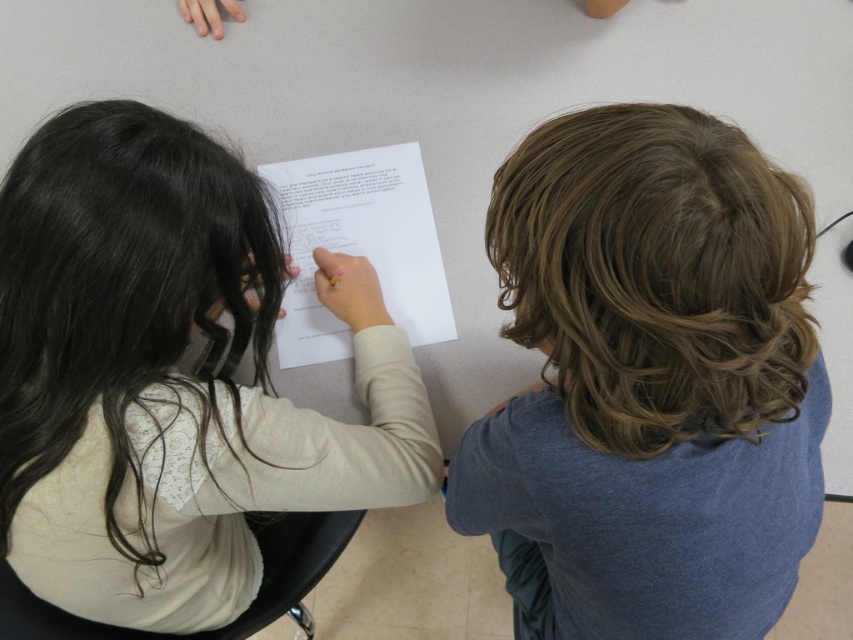
Question: Among these points, which one is nearest to the camera?

Choices:
 (A) (126, 136)
 (B) (318, 227)
 (C) (556, 621)

Answer: (A)

Question: Does smooth brown hair at center have a larger size compared to white paper at center?

Choices:
 (A) yes
 (B) no

Answer: (A)

Question: Among these objects, which one is farthest from the camera?

Choices:
 (A) light beige lace shirt at center
 (B) white paper at center
 (C) smooth brown hair at center

Answer: (B)

Question: Which point appears farthest from the camera in this image?

Choices:
 (A) (204, 173)
 (B) (605, 392)
 (C) (354, 227)

Answer: (C)

Question: Does smooth brown hair at center appear over white paper at center?

Choices:
 (A) no
 (B) yes

Answer: (A)

Question: Is smooth brown hair at center closer to camera compared to white paper at center?

Choices:
 (A) yes
 (B) no

Answer: (A)